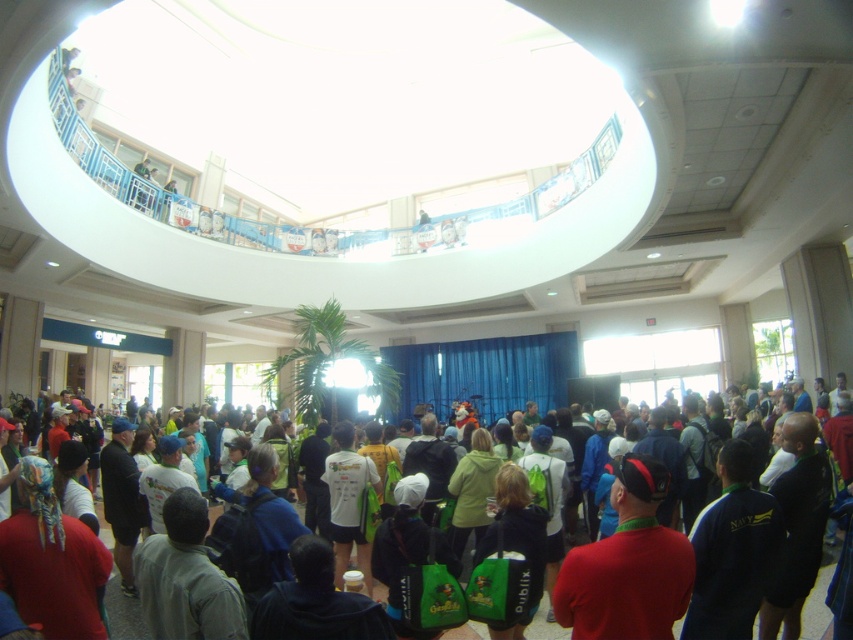
You are standing in the convention center and see a red matte shirt at center and a green fabric backpack at center. Which object is positioned more to the right?

The red matte shirt at center is positioned to the right of the green fabric backpack at center, so it is more to the right.

You are an event organizer who needs to ensure that all attendees can see the stage. You notice the red matte shirt at center and the green fabric backpack at center. Which object is blocking the view of the stage for someone standing behind it?

The red matte shirt at center is positioned over the green fabric backpack at center, so the red matte shirt at center is blocking the view of the stage for someone standing behind it.

You are organizing a photo shoot in the event space and need to ensure that both the red matte shirt at center and the green fabric backpack at center are visible in the frame. Given their sizes, which object should you prioritize positioning closer to the camera to maintain visibility?

The red matte shirt at center is larger than the green fabric backpack at center. To ensure both are visible, position the smaller green fabric backpack at center closer to the camera so its size matches the larger red matte shirt at center in the frame.